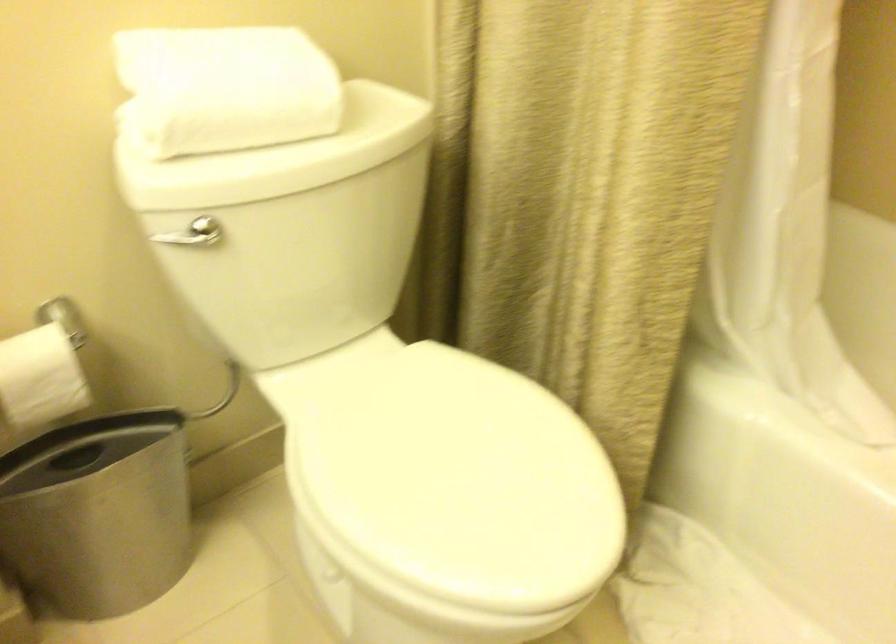
The width and height of the screenshot is (896, 644). Describe the element at coordinates (98, 514) in the screenshot. I see `the metal trash can` at that location.